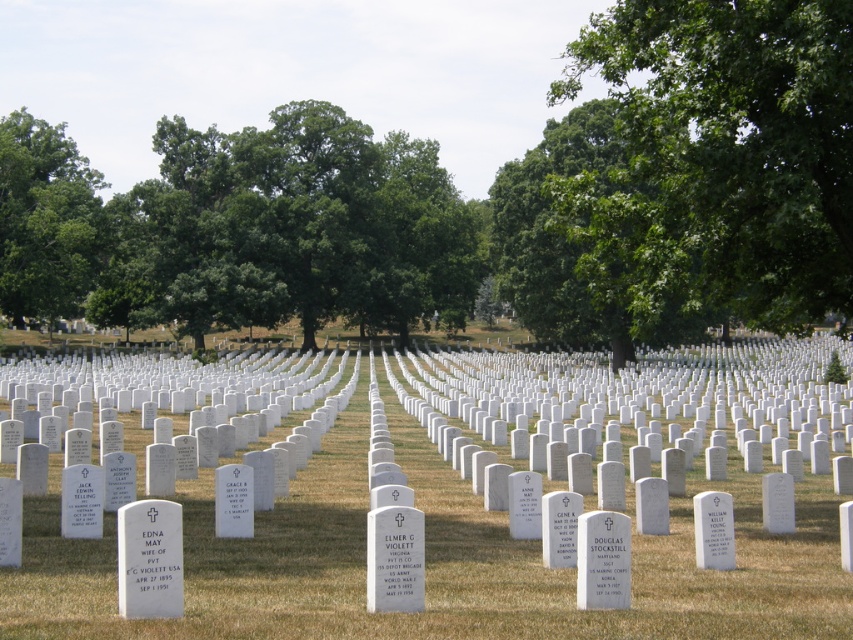
You are standing at the entrance of the cemetery and see the green grass at center and the green leafy tree at upper left. Which object is closer to the ground?

The green grass at center is closer to the ground because it is located below the green leafy tree at upper left.

You are a photographer planning to take a wide shot of the cemetery scene. You want to ensure both the green leafy tree at upper right and the green leafy tree at upper left are fully visible in your frame. Based on their widths, which tree might require you to adjust your camera angle more to include its entire canopy?

The green leafy tree at upper right might require adjusting the camera angle more because it might be wider than the green leafy tree at upper left according to the description.